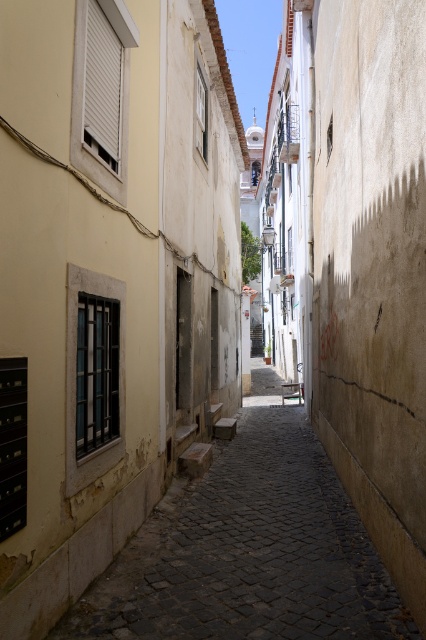
Question: From the image, what is the correct spatial relationship of smooth beige wall at right in relation to smooth stone alley at center?

Choices:
 (A) right
 (B) left

Answer: (A)

Question: Is smooth beige wall at right to the right of smooth stone alley at center from the viewer's perspective?

Choices:
 (A) no
 (B) yes

Answer: (B)

Question: Is smooth beige wall at right closer to camera compared to smooth stone alley at center?

Choices:
 (A) no
 (B) yes

Answer: (B)

Question: Which object is farther from the camera taking this photo?

Choices:
 (A) smooth beige wall at right
 (B) smooth stone alley at center

Answer: (B)